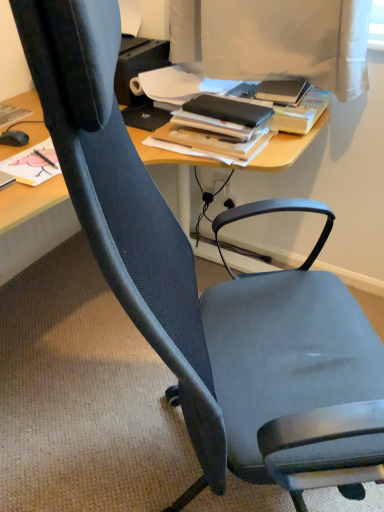
Question: Visually, is black matte book at center positioned to the left or to the right of matte black mouse at left?

Choices:
 (A) right
 (B) left

Answer: (A)

Question: Do you think black matte book at center is within matte black mouse at left, or outside of it?

Choices:
 (A) outside
 (B) inside

Answer: (A)

Question: Is point (244, 139) positioned closer to the camera than point (11, 135)?

Choices:
 (A) farther
 (B) closer

Answer: (B)

Question: Is matte black mouse at left spatially inside black matte book at center, or outside of it?

Choices:
 (A) outside
 (B) inside

Answer: (A)

Question: From a real-world perspective, is matte black mouse at left positioned above or below black matte book at center?

Choices:
 (A) below
 (B) above

Answer: (A)

Question: In the image, is matte black mouse at left positioned in front of or behind black matte book at center?

Choices:
 (A) front
 (B) behind

Answer: (B)

Question: Considering the positions of matte black mouse at left and black matte book at center in the image, is matte black mouse at left bigger or smaller than black matte book at center?

Choices:
 (A) big
 (B) small

Answer: (B)